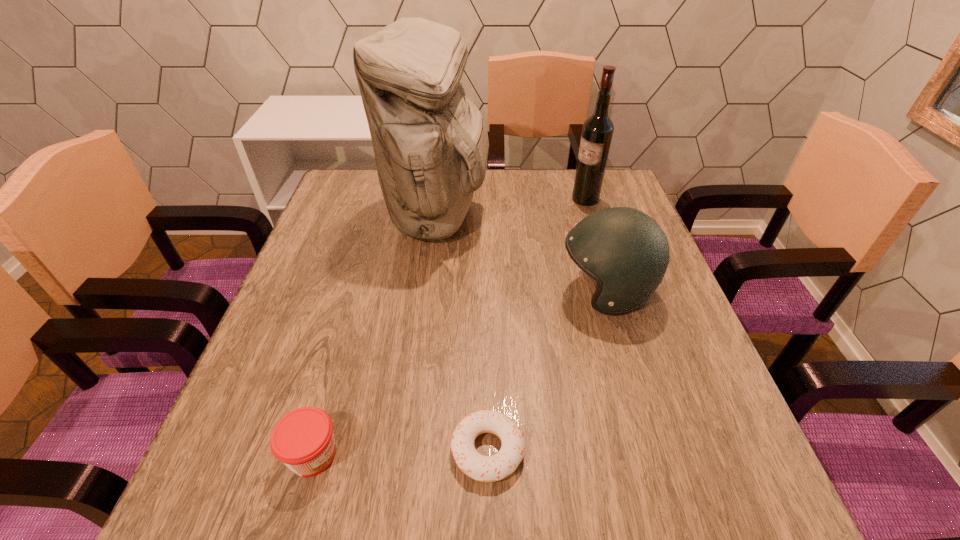
This screenshot has height=540, width=960. I want to click on vacant space located at the face opening of the football helmet, so click(x=523, y=291).

The height and width of the screenshot is (540, 960). What are the coordinates of `free space located 0.240m at the face opening of the football helmet` in the screenshot? It's located at (452, 291).

The width and height of the screenshot is (960, 540). In order to click on vacant space located on the label side of the second shortest object in this screenshot , I will do `click(531, 455)`.

Find the location of a particular element. This screenshot has width=960, height=540. free space located 0.230m on the back of the doughnut is located at coordinates (486, 318).

Locate an element on the screen. The image size is (960, 540). backpack present at the far edge is located at coordinates (430, 141).

This screenshot has height=540, width=960. I want to click on wine bottle that is at the far edge, so click(x=597, y=132).

Find the location of `jam located in the near edge section of the desktop`. jam located in the near edge section of the desktop is located at coordinates click(303, 439).

At what (x,y) coordinates should I click in order to perform the action: click on doughnut that is at the near edge. Please return your answer as a coordinate pair (x, y). Looking at the image, I should click on (482, 468).

You are a GUI agent. You are given a task and a screenshot of the screen. Output one action in this format:
    pyautogui.click(x=<x>, y=<y>)
    Task: Click on the object at the left edge
    
    Given the screenshot: What is the action you would take?
    pyautogui.click(x=303, y=439)

Locate an element on the screen. wine bottle at the right edge is located at coordinates (597, 132).